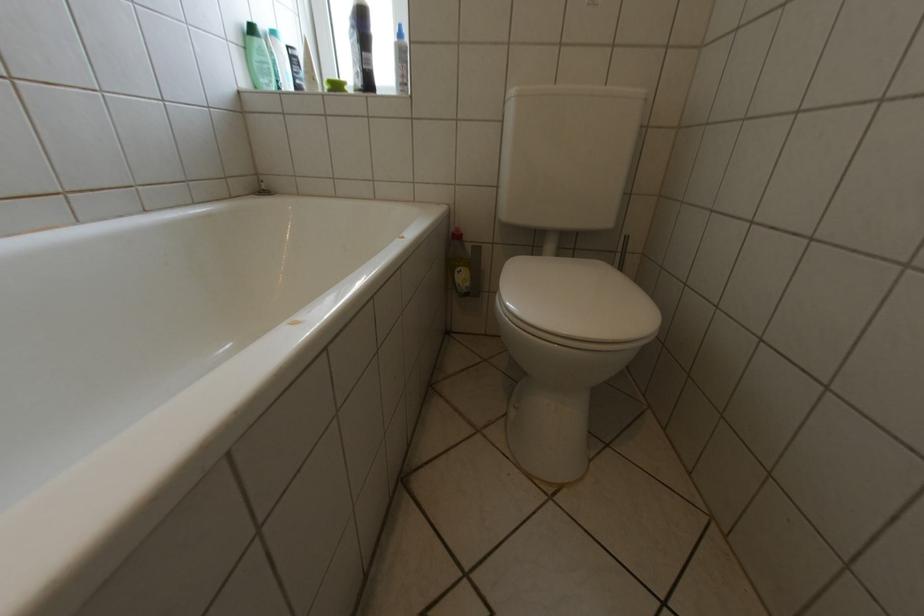
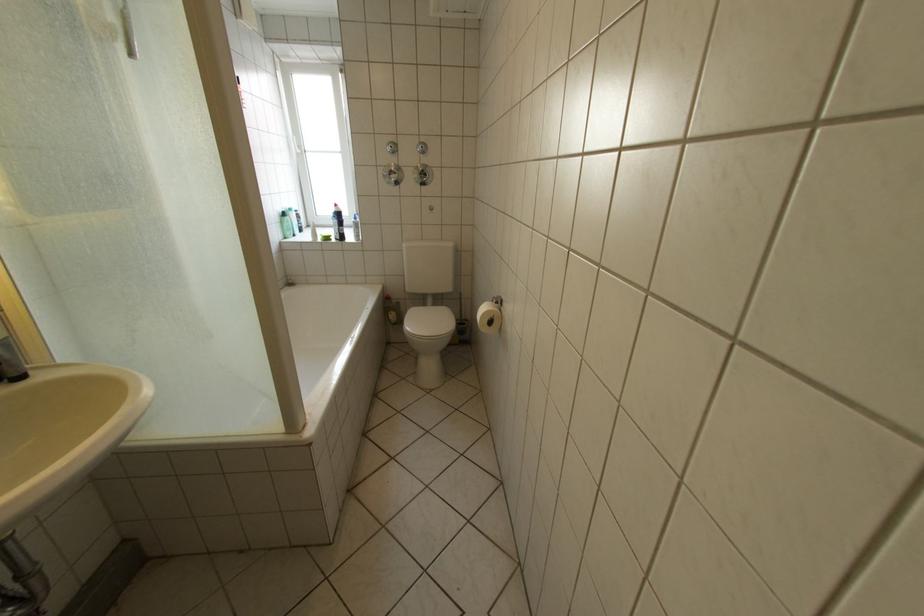
Where in the second image is the point corresponding to pixel 258 50 from the first image?

(294, 224)